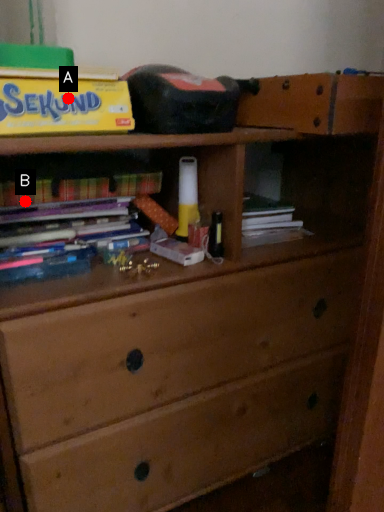
Question: Two points are circled on the image, labeled by A and B beside each circle. Which of the following is the closest to the observer?

Choices:
 (A) A is closer
 (B) B is closer

Answer: (A)